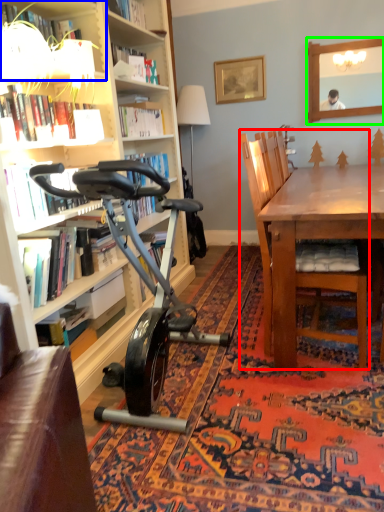
Question: Which is farther away from chair (highlighted by a red box)? shelf (highlighted by a blue box) or mirror (highlighted by a green box)?

Choices:
 (A) shelf
 (B) mirror

Answer: (B)